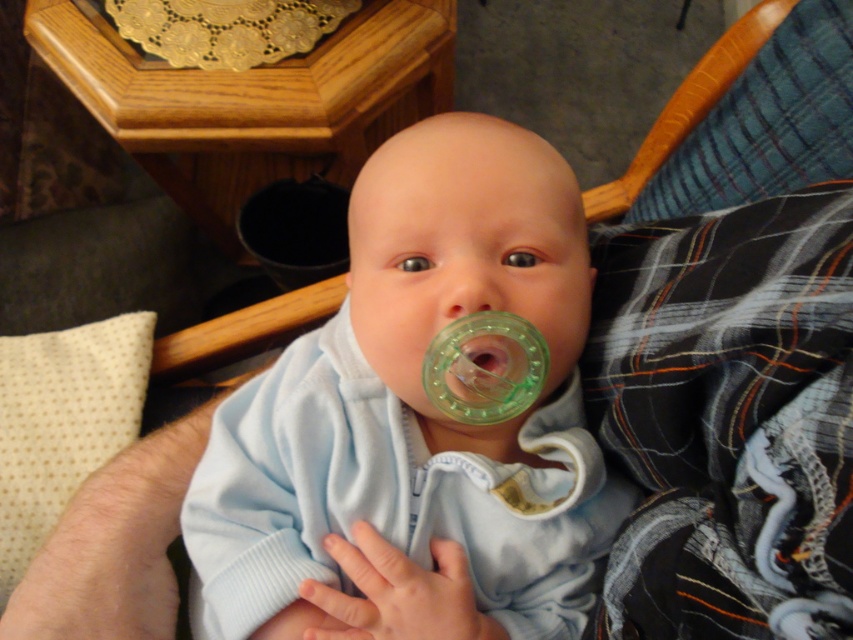
Question: Can you confirm if light blue fabric baby at center is smaller than green translucent pacifier at center?

Choices:
 (A) no
 (B) yes

Answer: (A)

Question: Among these points, which one is nearest to the camera?

Choices:
 (A) (474, 369)
 (B) (271, 452)

Answer: (A)

Question: Does light blue fabric baby at center have a smaller size compared to green translucent pacifier at center?

Choices:
 (A) no
 (B) yes

Answer: (A)

Question: Does light blue fabric baby at center lie behind green translucent pacifier at center?

Choices:
 (A) no
 (B) yes

Answer: (A)